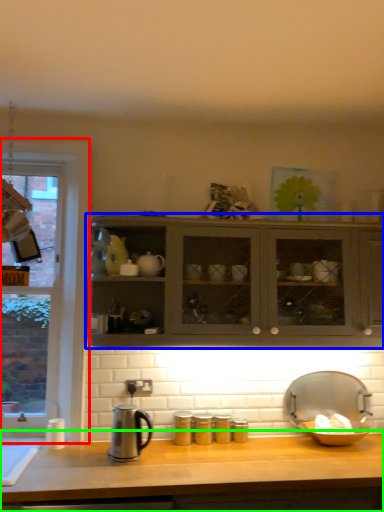
Question: Which is nearer to the window (highlighted by a red box)? cabinetry (highlighted by a blue box) or countertop (highlighted by a green box).

Choices:
 (A) cabinetry
 (B) countertop

Answer: (A)